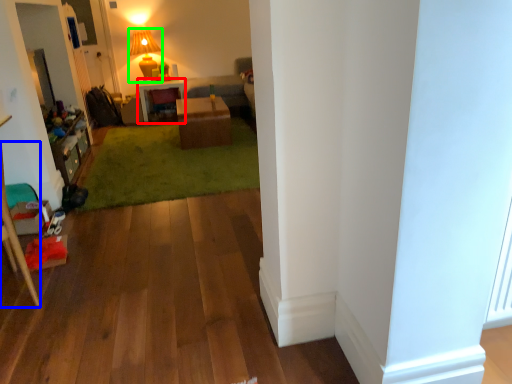
Question: Estimate the real-world distances between objects in this image. Which object is closer to desk (highlighted by a red box), furniture (highlighted by a blue box) or lamp (highlighted by a green box)?

Choices:
 (A) furniture
 (B) lamp

Answer: (B)